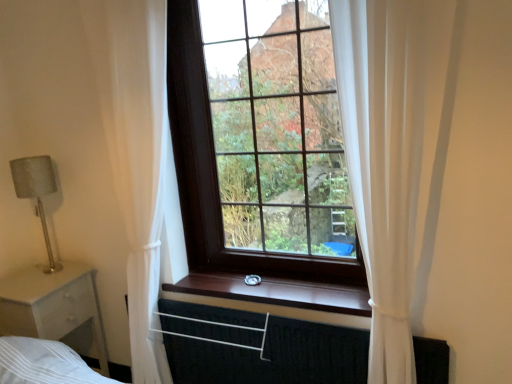
Locate an element on the screen. This screenshot has height=384, width=512. blank space above white matte nightstand at left (from a real-world perspective) is located at coordinates (37, 281).